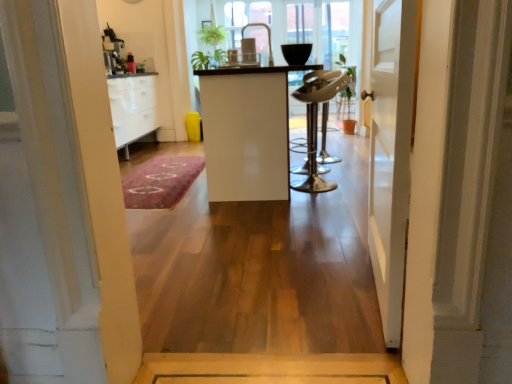
Locate an element on the screen. This screenshot has width=512, height=384. vacant space situated above pink carpet at center (from a real-world perspective) is located at coordinates (167, 170).